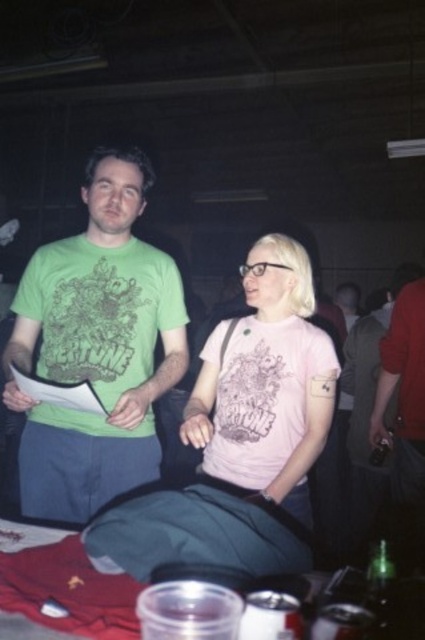
Looking at this image, which is more to the right, pink matte shirt at center or red matte shirt at right?

From the viewer's perspective, red matte shirt at right appears more on the right side.

Which is in front, point (209, 436) or point (376, 394)?

Point (209, 436) is in front.

This screenshot has width=425, height=640. In order to click on pink matte shirt at center in this screenshot , I will do pos(266,381).

Does green printed t-shirt at center have a greater height compared to pink matte shirt at center?

Indeed, green printed t-shirt at center has a greater height compared to pink matte shirt at center.

Between point (135, 470) and point (209, 429), which one is positioned in front?

Point (209, 429)

Where is `green printed t-shirt at center`? green printed t-shirt at center is located at coordinates (95, 355).

Can you confirm if green matte t-shirt at center is wider than pink matte shirt at center?

Yes, green matte t-shirt at center is wider than pink matte shirt at center.

Between green matte t-shirt at center and pink matte shirt at center, which one has more height?

green matte t-shirt at center is taller.

Between point (130, 314) and point (277, 278), which one is positioned in front?

Point (130, 314) is in front.

What are the coordinates of `green matte t-shirt at center` in the screenshot? It's located at (96, 348).